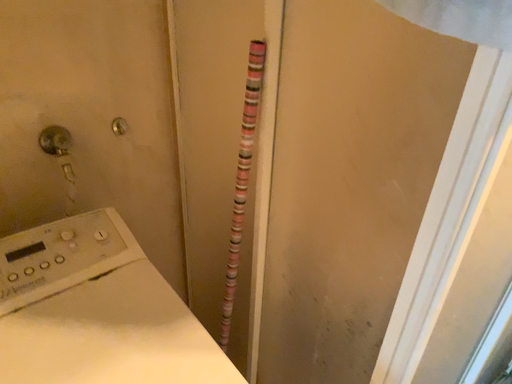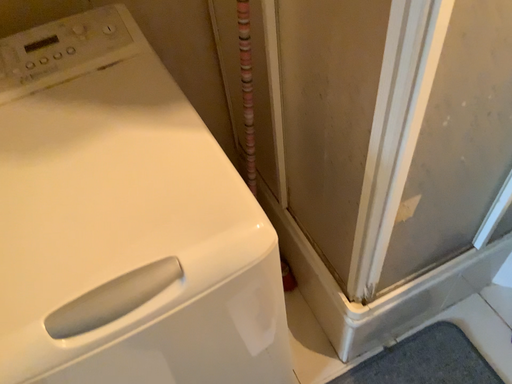
Question: How did the camera likely rotate when shooting the video?

Choices:
 (A) rotated upward
 (B) rotated downward

Answer: (B)